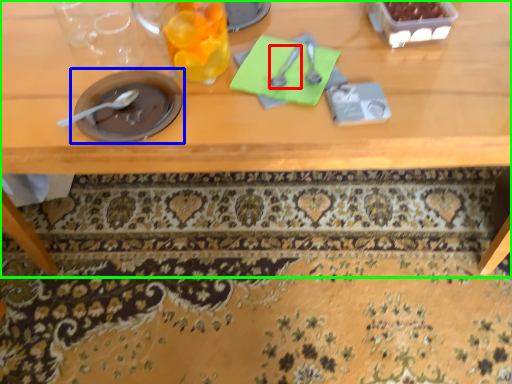
Question: Based on their relative distances, which object is nearer to tableware (highlighted by a red box)? Choose from tableware (highlighted by a blue box) and table (highlighted by a green box).

Choices:
 (A) tableware
 (B) table

Answer: (A)